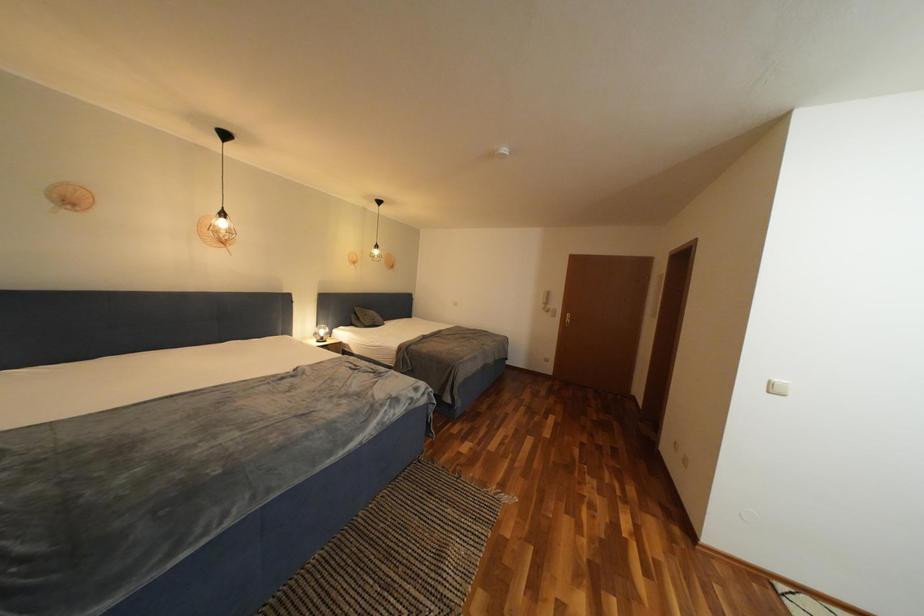
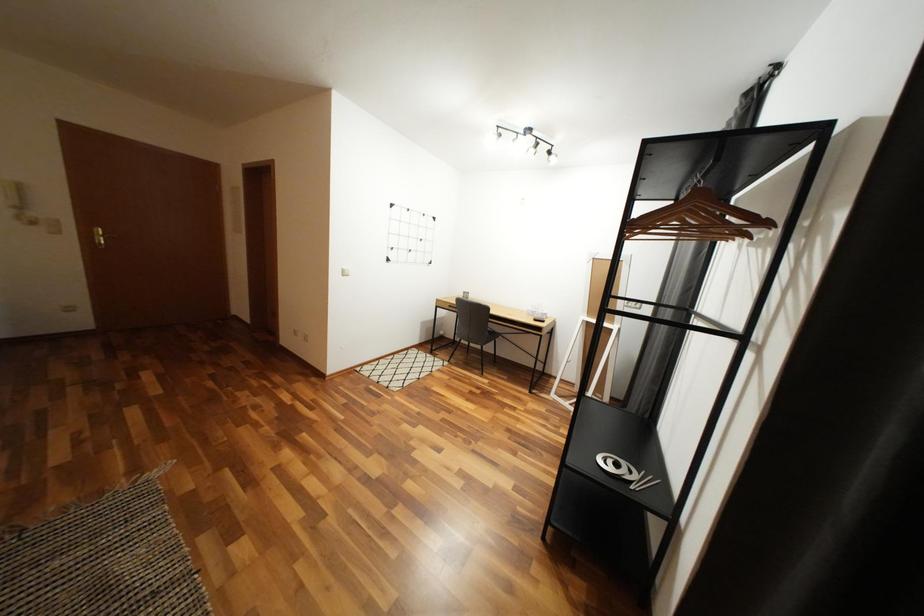
The first image is from the beginning of the video and the second image is from the end. How did the camera likely rotate when shooting the video?

The rotation direction of the camera is right-down.